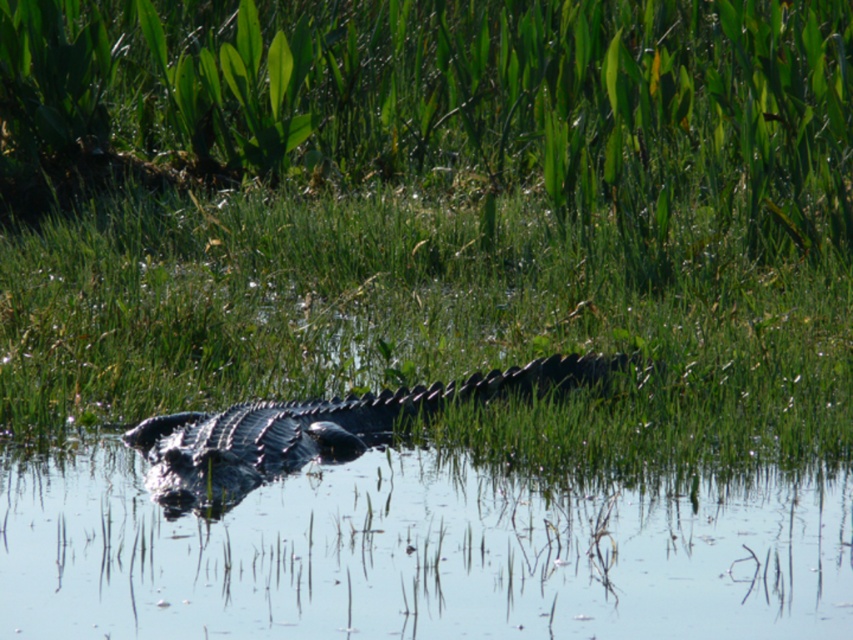
Question: Which object is the closest to the green rough grass at center?

Choices:
 (A) clear water at center
 (B) dark green scaly crocodile at center

Answer: (A)

Question: Can you confirm if green rough grass at center is thinner than clear water at center?

Choices:
 (A) yes
 (B) no

Answer: (B)

Question: Which object is farther from the camera taking this photo?

Choices:
 (A) clear water at center
 (B) green rough grass at center
 (C) dark green scaly crocodile at center

Answer: (B)

Question: Can you confirm if clear water at center is positioned above dark green scaly crocodile at center?

Choices:
 (A) no
 (B) yes

Answer: (A)

Question: Which object is positioned closest to the green rough grass at center?

Choices:
 (A) dark green scaly crocodile at center
 (B) clear water at center

Answer: (B)

Question: Does green rough grass at center have a smaller size compared to dark green scaly crocodile at center?

Choices:
 (A) no
 (B) yes

Answer: (A)